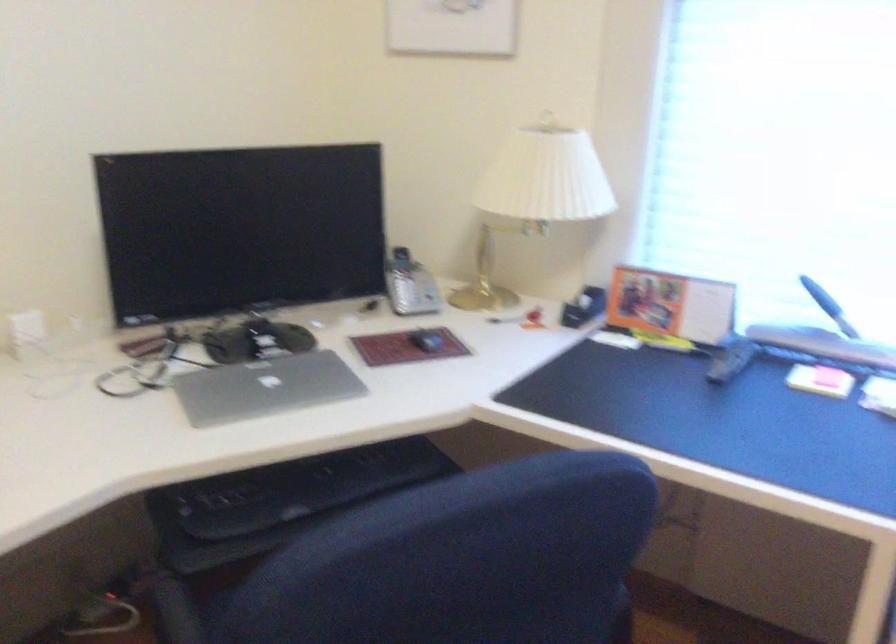
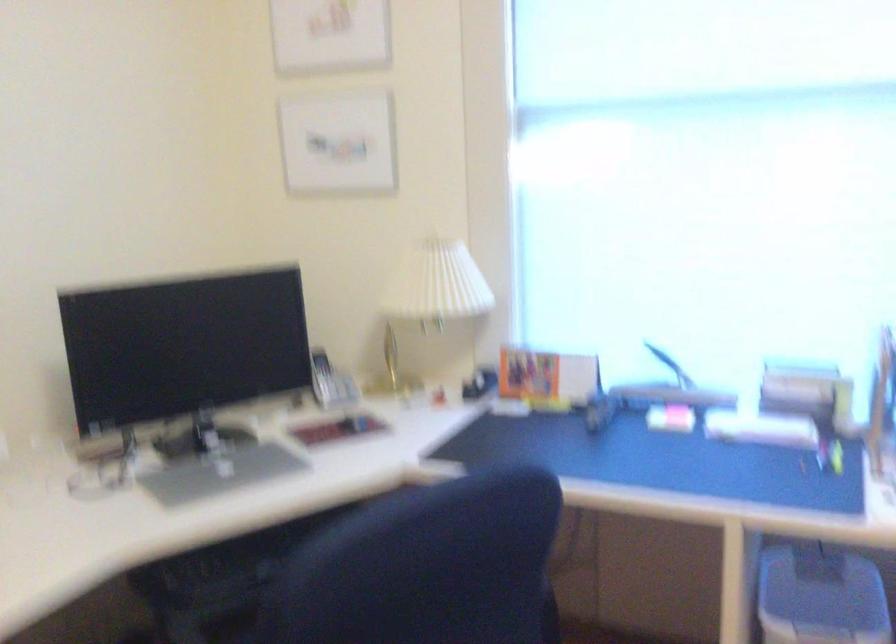
Find the pixel in the second image that matches (411,285) in the first image.

(330, 382)